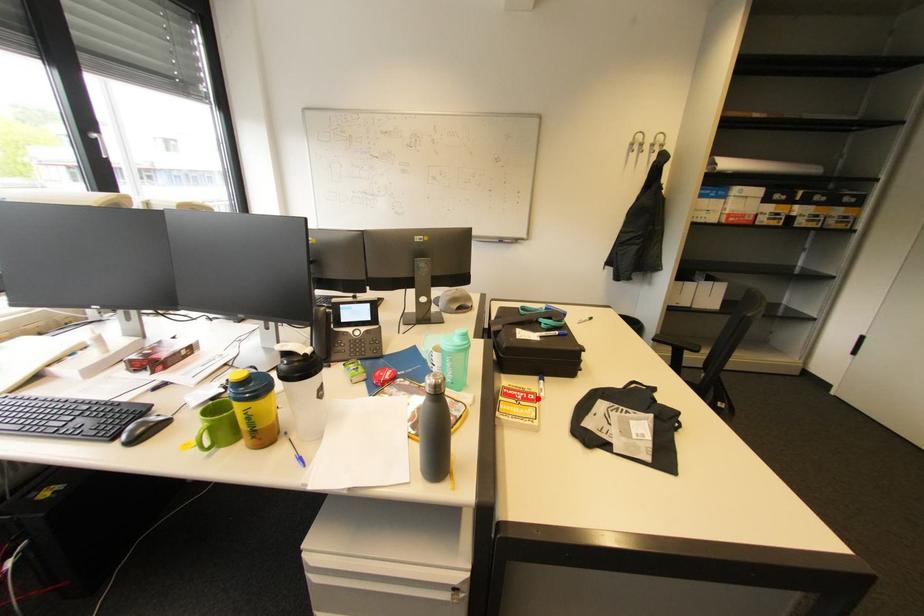
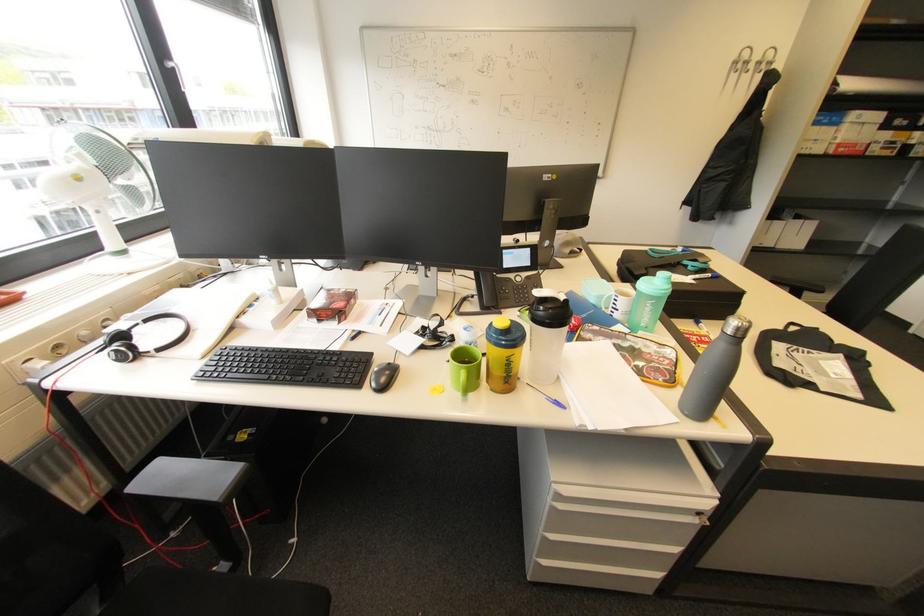
Find the pixel in the second image that matches the highlighted location in the first image.

(713, 341)